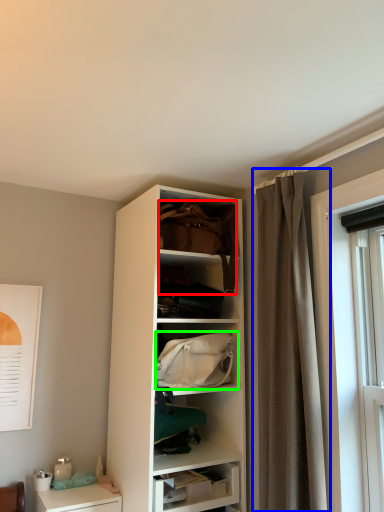
Question: Based on their relative distances, which object is nearer to handbag (highlighted by a red box)? Choose from curtain (highlighted by a blue box) and handbag (highlighted by a green box).

Choices:
 (A) curtain
 (B) handbag

Answer: (A)